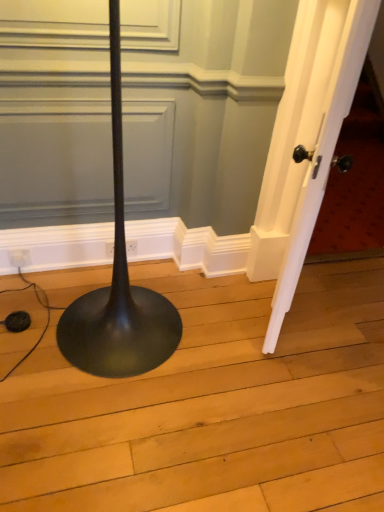
What are the coordinates of `free space to the left of white wooden door at right` in the screenshot? It's located at (222, 313).